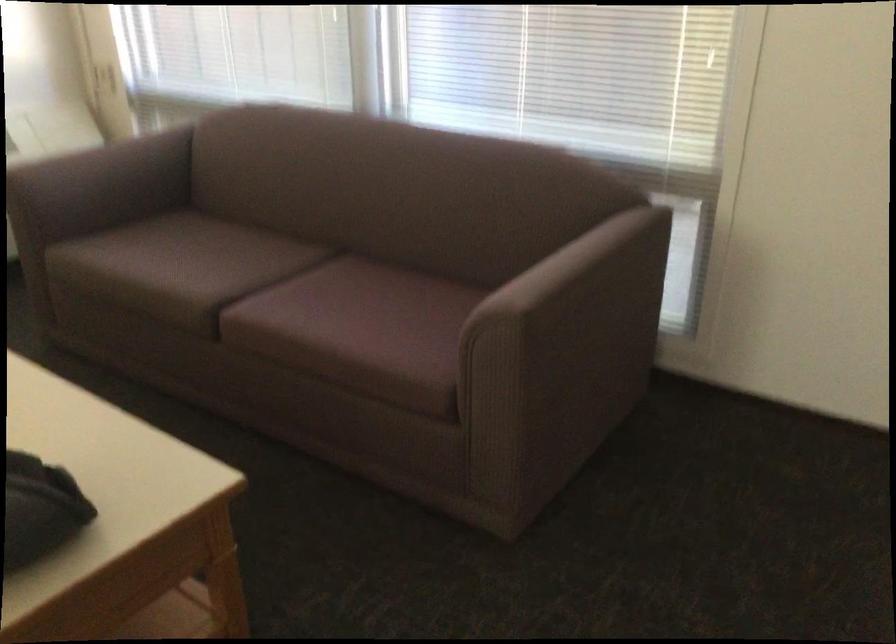
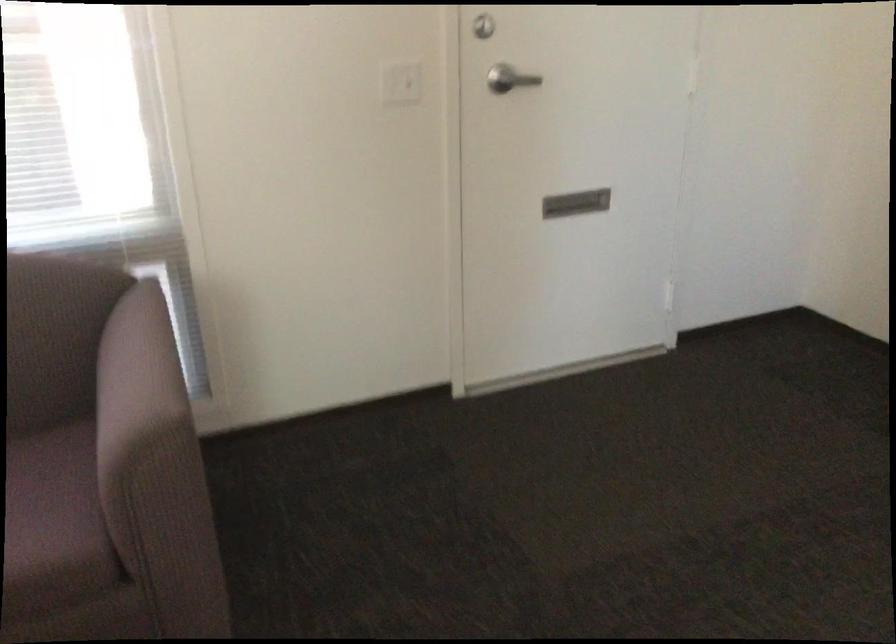
In the second image, find the point that corresponds to (x=449, y=352) in the first image.

(53, 520)